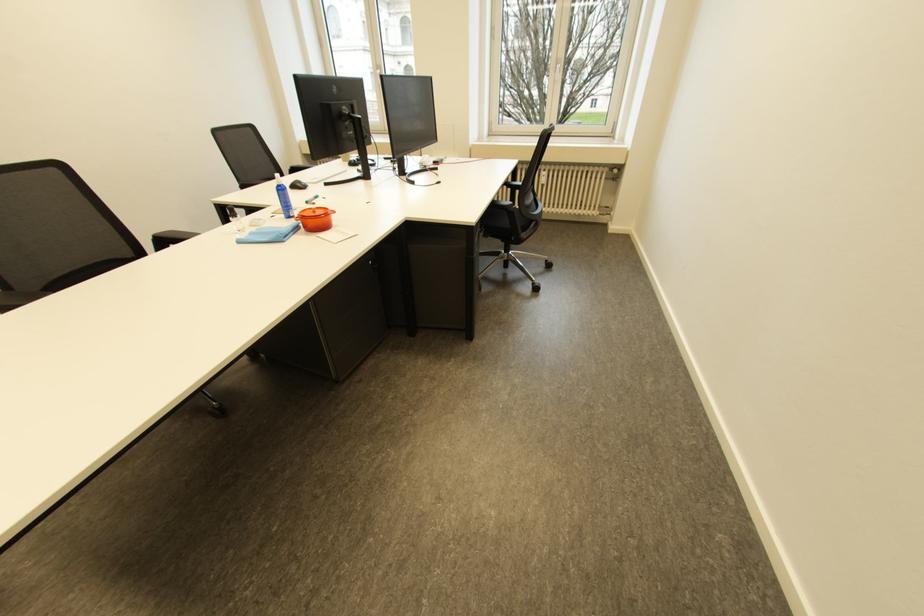
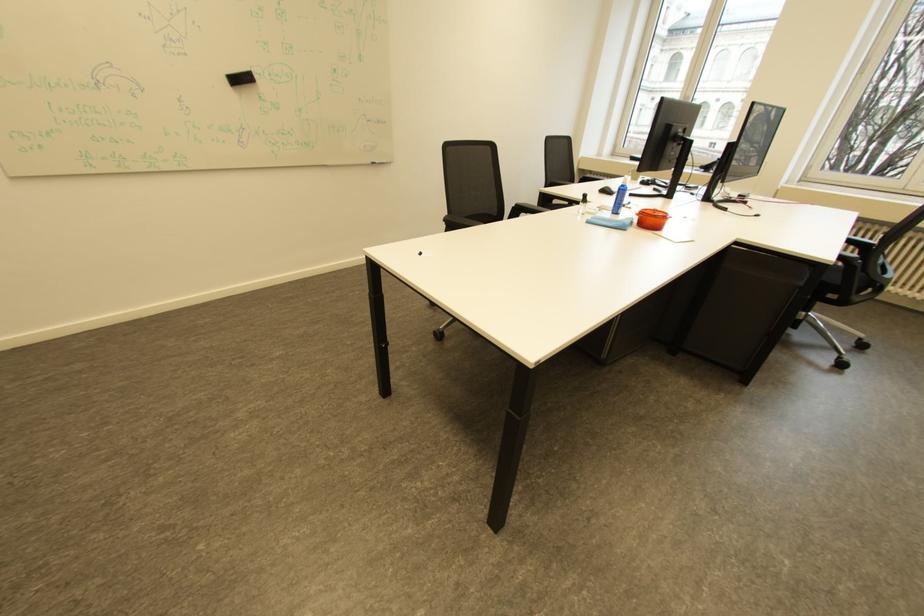
In the second image, find the point that corresponds to (515,224) in the first image.

(845, 278)